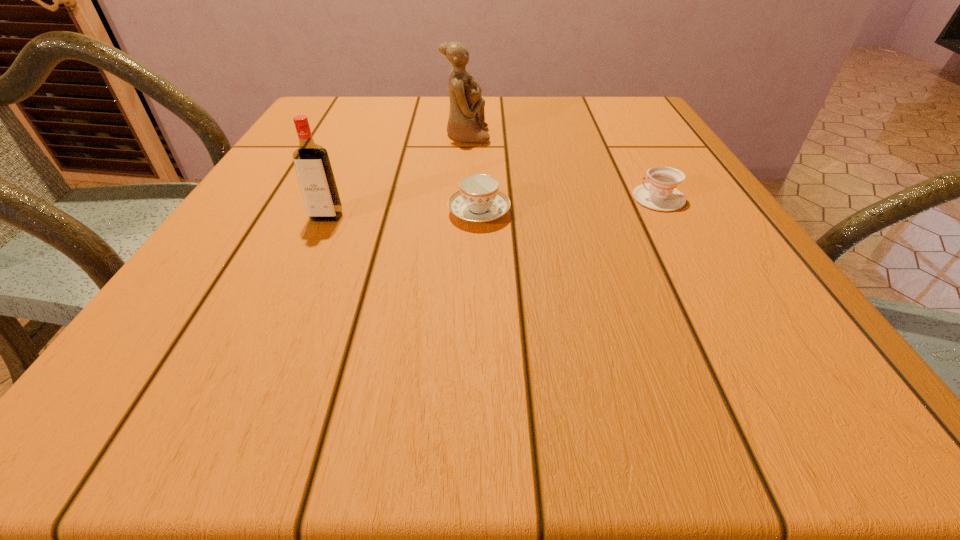
Identify which object is the closest to the vodka. Please provide its 2D coordinates. Your answer should be formatted as a tuple, i.e. [(x, y)], where the tuple contains the x and y coordinates of a point satisfying the conditions above.

[(478, 200)]

Locate which object ranks second in proximity to the rightmost object. Please provide its 2D coordinates. Your answer should be formatted as a tuple, i.e. [(x, y)], where the tuple contains the x and y coordinates of a point satisfying the conditions above.

[(466, 121)]

You are a GUI agent. You are given a task and a screenshot of the screen. Output one action in this format:
    pyautogui.click(x=<x>, y=<y>)
    Task: Click on the free point that satisfies the following two spatial constraints: 1. on the handle side of the rightmost object; 2. on the front and back of the vodka
    The width and height of the screenshot is (960, 540).
    Given the screenshot: What is the action you would take?
    pyautogui.click(x=669, y=217)

Locate an element on the screen. Image resolution: width=960 pixels, height=540 pixels. vacant space that satisfies the following two spatial constraints: 1. on the front-facing side of the farthest object; 2. on the side with the handle of the second shortest object is located at coordinates (463, 212).

At what (x,y) coordinates should I click in order to perform the action: click on free space that satisfies the following two spatial constraints: 1. on the handle side of the right teacup; 2. on the front and back of the vodka. Please return your answer as a coordinate pair (x, y). Looking at the image, I should click on (669, 217).

You are a GUI agent. You are given a task and a screenshot of the screen. Output one action in this format:
    pyautogui.click(x=<x>, y=<y>)
    Task: Click on the free space that satisfies the following two spatial constraints: 1. on the front-facing side of the farthest object; 2. on the front and back of the leftmost object
    
    Given the screenshot: What is the action you would take?
    pyautogui.click(x=462, y=217)